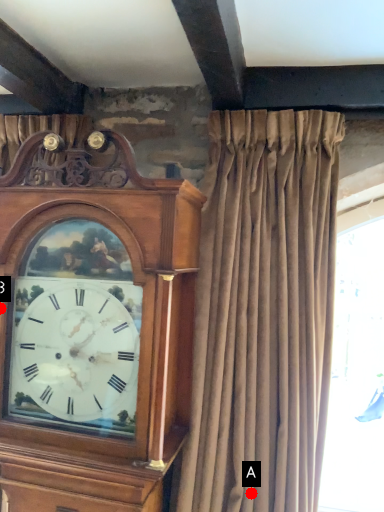
Question: Two points are circled on the image, labeled by A and B beside each circle. Which point is farther from the camera taking this photo?

Choices:
 (A) A is further
 (B) B is further

Answer: (A)